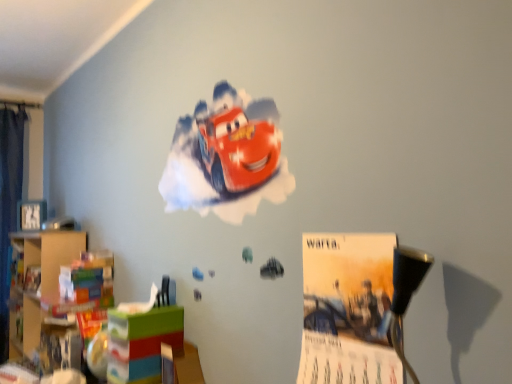
Locate an element on the screen. wooden bookshelf at left is located at coordinates (48, 255).

What do you see at coordinates (48, 255) in the screenshot?
I see `wooden bookshelf at left` at bounding box center [48, 255].

Locate an element on the screen. The image size is (512, 384). matte paper poster at center is located at coordinates (347, 310).

Considering the positions of point (149, 372) and point (70, 246), is point (149, 372) closer or farther from the camera than point (70, 246)?

Point (149, 372) appears to be closer to the viewer than point (70, 246).

Which of these two, matte plastic toy box at lower left or wooden bookshelf at left, is bigger?

wooden bookshelf at left is bigger.

From a real-world perspective, is matte plastic toy box at lower left physically above wooden bookshelf at left?

Incorrect, from a real-world perspective, matte plastic toy box at lower left is lower than wooden bookshelf at left.

Based on the photo, is matte plastic toy box at lower left far from wooden bookshelf at left?

No, matte plastic toy box at lower left is not far away from wooden bookshelf at left.

Is matte paper poster at center aimed at matte plastic toy box at lower left?

No, matte paper poster at center is not turned towards matte plastic toy box at lower left.

Between matte paper poster at center and matte plastic toy box at lower left, which one appears on the right side from the viewer's perspective?

Positioned to the right is matte paper poster at center.

Is matte paper poster at center next to matte plastic toy box at lower left?

No.

Is matte paper poster at center located within matte plastic toy box at lower left?

No, matte plastic toy box at lower left does not contain matte paper poster at center.

In terms of width, does matte plastic toy box at lower left look wider or thinner when compared to matte paper poster at center?

Clearly, matte plastic toy box at lower left has more width compared to matte paper poster at center.

Where is `poster page in front of the matte plastic toy box at lower left`? poster page in front of the matte plastic toy box at lower left is located at coordinates (347, 310).

Consider the image. From the image's perspective, is wooden bookshelf at left positioned above or below matte plastic toy box at lower left?

From the image's perspective, wooden bookshelf at left appears below matte plastic toy box at lower left.

Choose the correct answer: Is wooden bookshelf at left inside matte plastic toy box at lower left or outside it?

wooden bookshelf at left is not inside matte plastic toy box at lower left, it's outside.

In the scene shown: Does wooden bookshelf at left touch matte plastic toy box at lower left?

No, wooden bookshelf at left is not with matte plastic toy box at lower left.

Which is in front, wooden bookshelf at left or matte plastic toy box at lower left?

matte plastic toy box at lower left is more forward.

In order to click on poster page located above the wooden bookshelf at left (from a real-world perspective) in this screenshot , I will do click(347, 310).

From their relative heights in the image, would you say matte paper poster at center is taller or shorter than wooden bookshelf at left?

matte paper poster at center is shorter than wooden bookshelf at left.

How far apart are matte paper poster at center and wooden bookshelf at left?

matte paper poster at center and wooden bookshelf at left are 1.85 meters apart.

Relative to wooden bookshelf at left, is matte paper poster at center in front or behind?

matte paper poster at center is positioned closer to the viewer than wooden bookshelf at left.

Between wooden bookshelf at left and matte paper poster at center, which one is positioned in front?

matte paper poster at center is closer to the camera.

From the image's perspective, would you say wooden bookshelf at left is shown under matte paper poster at center?

Correct, wooden bookshelf at left appears lower than matte paper poster at center in the image.

Could you tell me if wooden bookshelf at left is turned towards matte paper poster at center?

No, wooden bookshelf at left is not turned towards matte paper poster at center.

Is point (58, 273) positioned behind point (362, 380)?

Yes, point (58, 273) is farther from viewer.

Locate an element on the screen. bookshelf behind the matte plastic toy box at lower left is located at coordinates (48, 255).

Identify the location of poster page that appears in front of the matte plastic toy box at lower left. This screenshot has height=384, width=512. (347, 310).

Which object lies nearer to the anchor point matte paper poster at center, matte plastic toy box at lower left or wooden bookshelf at left?

matte plastic toy box at lower left is closer to matte paper poster at center.

Looking at the image, which one is located further to matte plastic toy box at lower left, wooden bookshelf at left or matte paper poster at center?

wooden bookshelf at left is positioned further to the anchor matte plastic toy box at lower left.

When comparing their distances from matte paper poster at center, does wooden bookshelf at left or matte plastic toy box at lower left seem further?

wooden bookshelf at left lies further to matte paper poster at center than the other object.

Looking at the image, which one is located further to wooden bookshelf at left, matte plastic toy box at lower left or matte paper poster at center?

Based on the image, matte paper poster at center appears to be further to wooden bookshelf at left.

Estimate the real-world distances between objects in this image. Which object is further from wooden bookshelf at left, matte paper poster at center or matte plastic toy box at lower left?

Based on the image, matte paper poster at center appears to be further to wooden bookshelf at left.

From the image, which object appears to be farther from matte plastic toy box at lower left, matte paper poster at center or wooden bookshelf at left?

The object further to matte plastic toy box at lower left is wooden bookshelf at left.

You are a GUI agent. You are given a task and a screenshot of the screen. Output one action in this format:
    pyautogui.click(x=<x>, y=<y>)
    Task: Click on the shelf located between wooden bookshelf at left and matte paper poster at center in the left-right direction
    The height and width of the screenshot is (384, 512).
    Given the screenshot: What is the action you would take?
    pyautogui.click(x=141, y=343)